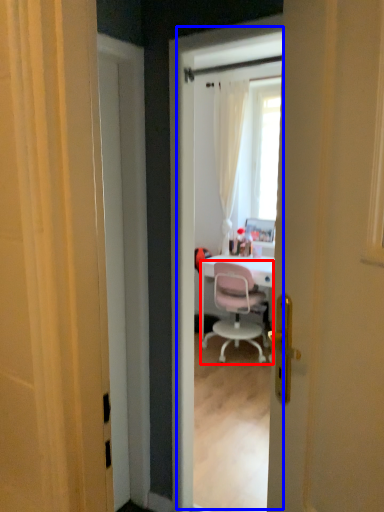
Question: Among these objects, which one is nearest to the camera, chair (highlighted by a red box) or screen door (highlighted by a blue box)?

Choices:
 (A) chair
 (B) screen door

Answer: (B)